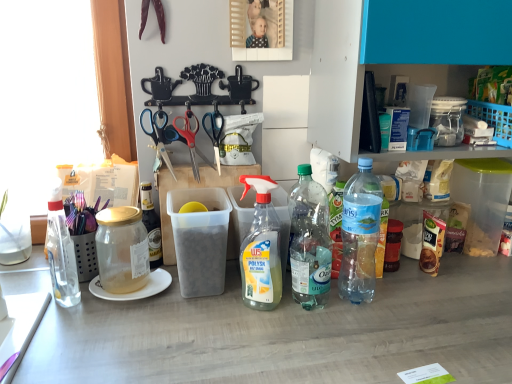
This screenshot has width=512, height=384. I want to click on free location to the right of transparent glass jar at left, marked as the second bottle in a left-to-right arrangement, so click(161, 284).